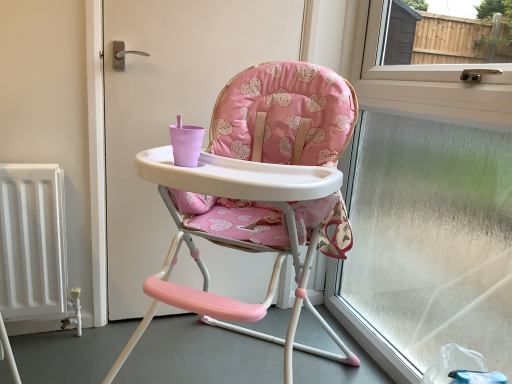
Question: Does pink fabric highchair at center have a smaller size compared to transparent glass window at right?

Choices:
 (A) no
 (B) yes

Answer: (A)

Question: From a real-world perspective, is pink fabric highchair at center on top of transparent glass window at right?

Choices:
 (A) yes
 (B) no

Answer: (B)

Question: From the image's perspective, is pink fabric highchair at center located above transparent glass window at right?

Choices:
 (A) yes
 (B) no

Answer: (B)

Question: Does pink fabric highchair at center have a lesser height compared to transparent glass window at right?

Choices:
 (A) yes
 (B) no

Answer: (A)

Question: Is pink fabric highchair at center taller than transparent glass window at right?

Choices:
 (A) yes
 (B) no

Answer: (B)

Question: Does pink fabric highchair at center contain transparent glass window at right?

Choices:
 (A) no
 (B) yes

Answer: (A)

Question: Does transparent glass window at right touch pink fabric highchair at center?

Choices:
 (A) yes
 (B) no

Answer: (B)

Question: Is the depth of transparent glass window at right greater than that of pink fabric highchair at center?

Choices:
 (A) yes
 (B) no

Answer: (A)

Question: From the image's perspective, is transparent glass window at right under pink fabric highchair at center?

Choices:
 (A) yes
 (B) no

Answer: (B)

Question: Considering the relative sizes of transparent glass window at right and pink fabric highchair at center in the image provided, is transparent glass window at right smaller than pink fabric highchair at center?

Choices:
 (A) no
 (B) yes

Answer: (B)

Question: Considering the relative positions of transparent glass window at right and pink fabric highchair at center in the image provided, is transparent glass window at right to the left of pink fabric highchair at center from the viewer's perspective?

Choices:
 (A) yes
 (B) no

Answer: (B)

Question: Does transparent glass window at right lie in front of pink fabric highchair at center?

Choices:
 (A) yes
 (B) no

Answer: (B)

Question: Is point (202, 168) positioned closer to the camera than point (454, 192)?

Choices:
 (A) farther
 (B) closer

Answer: (B)